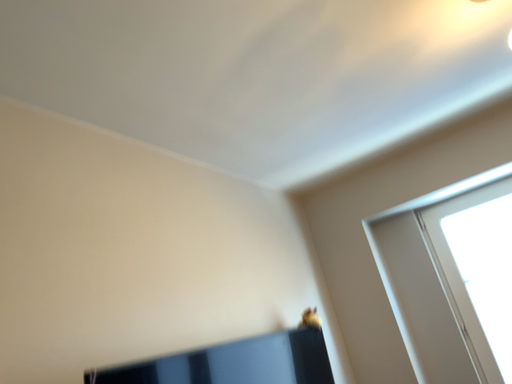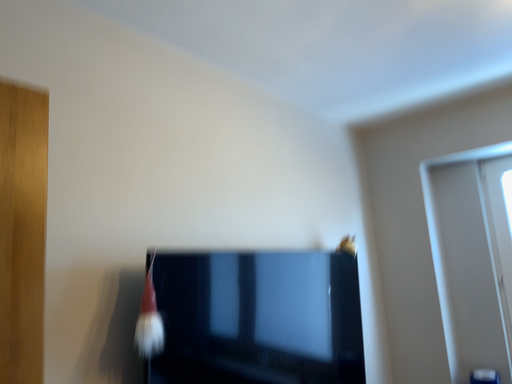
Question: How did the camera likely rotate when shooting the video?

Choices:
 (A) rotated left
 (B) rotated right

Answer: (A)